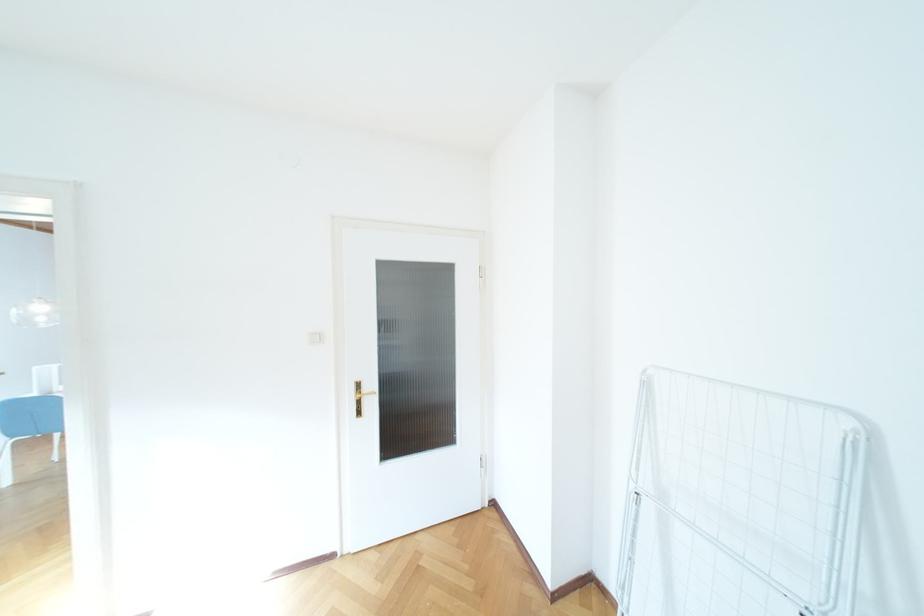
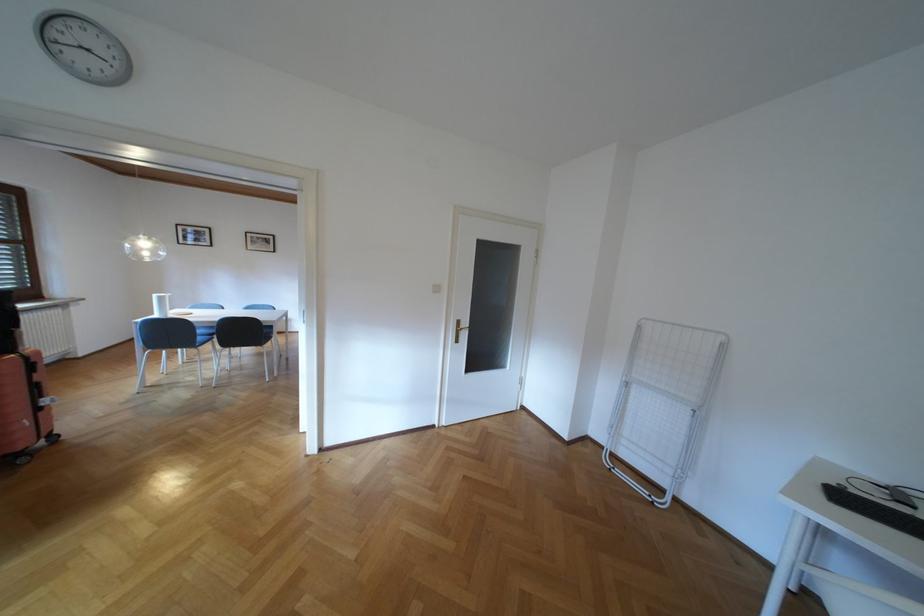
Which direction would the cameraman need to move to produce the second image?

The movement direction of the cameraman is left, backward.